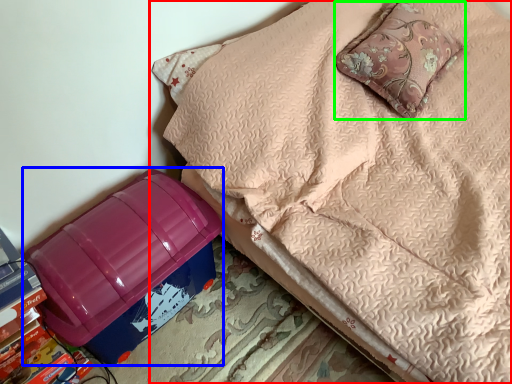
Question: Which object is positioned closest to furniture (highlighted by a red box)? Select from storage box (highlighted by a blue box) and pillow (highlighted by a green box).

Choices:
 (A) storage box
 (B) pillow

Answer: (B)